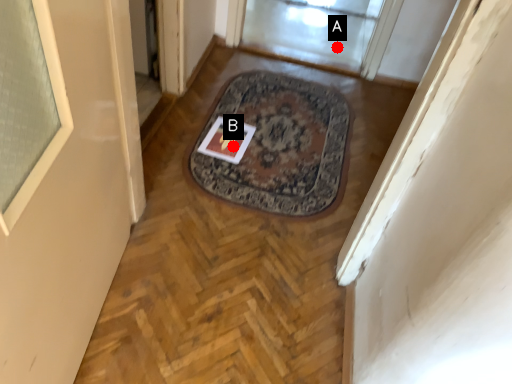
Question: Two points are circled on the image, labeled by A and B beside each circle. Among these points, which one is farthest from the camera?

Choices:
 (A) A is further
 (B) B is further

Answer: (A)